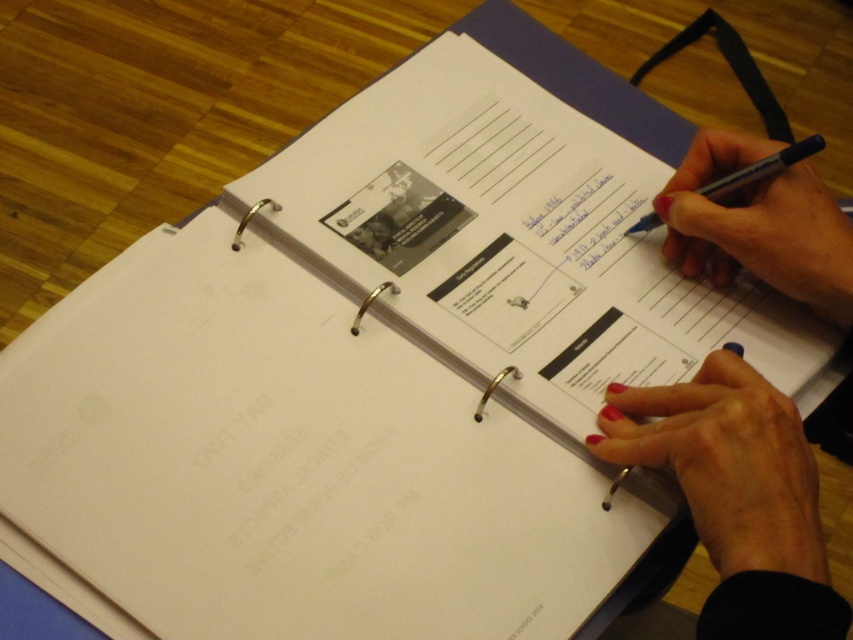
Question: Which of these objects is positioned closest to the nail polish red hand at upper right?

Choices:
 (A) black pen at upper right
 (B) nail polish at lower right

Answer: (A)

Question: Is smooth skin hand at upper right closer to the viewer compared to black pen at upper right?

Choices:
 (A) no
 (B) yes

Answer: (B)

Question: Which point is closer to the camera?

Choices:
 (A) black pen at upper right
 (B) nail polish red hand at upper right
 (C) smooth skin hand at upper right
 (D) nail polish at lower right

Answer: (C)

Question: Is nail polish at lower right bigger than nail polish red hand at upper right?

Choices:
 (A) yes
 (B) no

Answer: (B)

Question: Does smooth skin hand at upper right have a greater width compared to nail polish at lower right?

Choices:
 (A) no
 (B) yes

Answer: (B)

Question: Which point is farther to the camera?

Choices:
 (A) nail polish at lower right
 (B) black pen at upper right
 (C) smooth skin hand at upper right
 (D) nail polish red hand at upper right

Answer: (D)